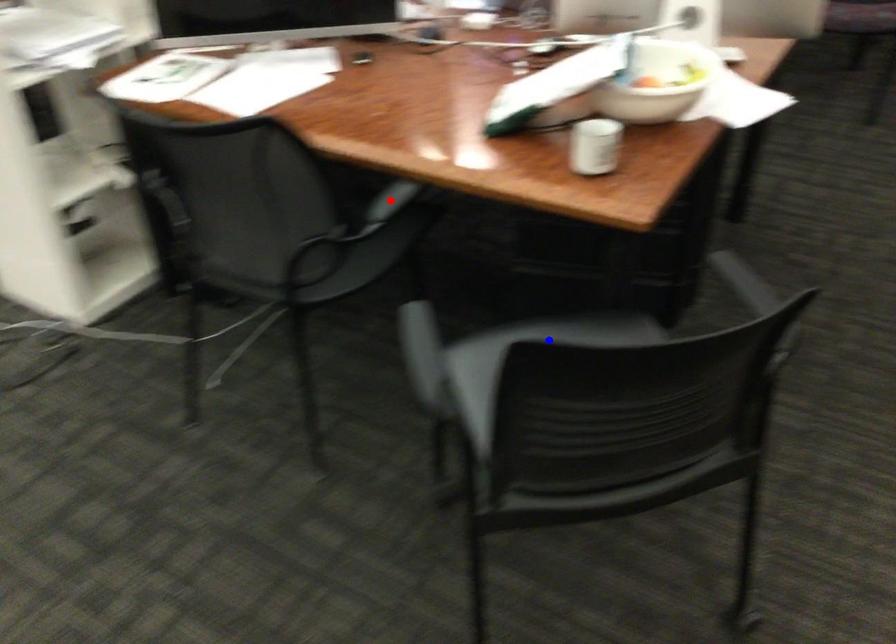
Question: Which of the two points in the image is closer to the camera?

Choices:
 (A) Blue point is closer.
 (B) Red point is closer.

Answer: (A)